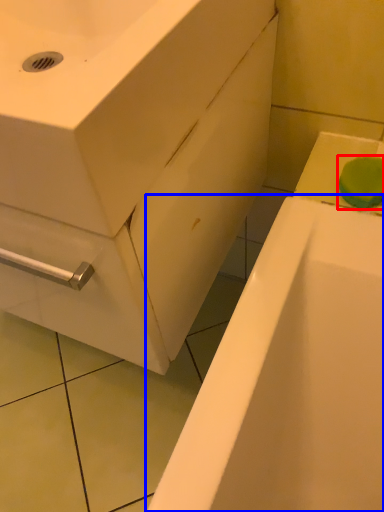
Question: Which point is further to the camera, soap (highlighted by a red box) or bathtub (highlighted by a blue box)?

Choices:
 (A) soap
 (B) bathtub

Answer: (B)